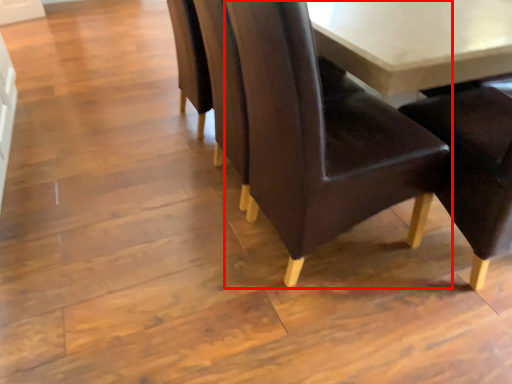
Question: From the image's perspective, where is chair (annotated by the red box) located relative to table?

Choices:
 (A) below
 (B) above

Answer: (B)